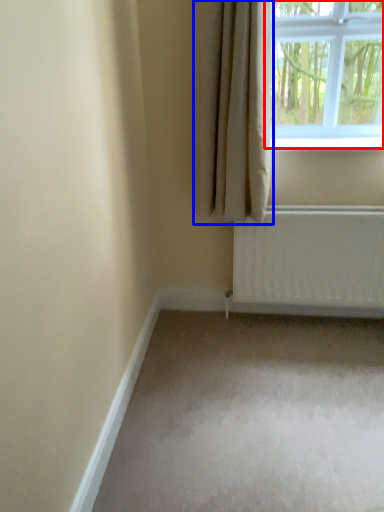
Question: Among these objects, which one is nearest to the camera, window (highlighted by a red box) or curtain (highlighted by a blue box)?

Choices:
 (A) window
 (B) curtain

Answer: (B)